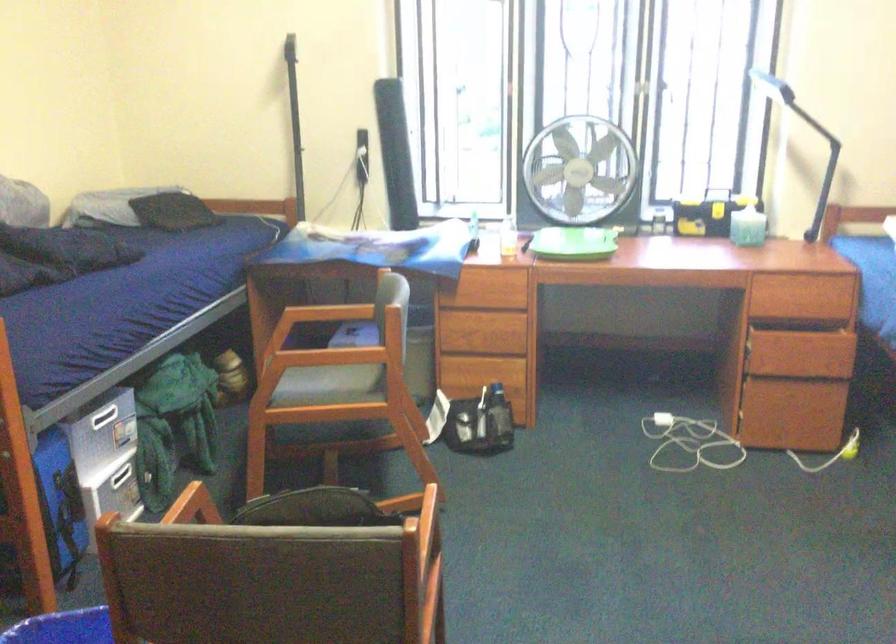
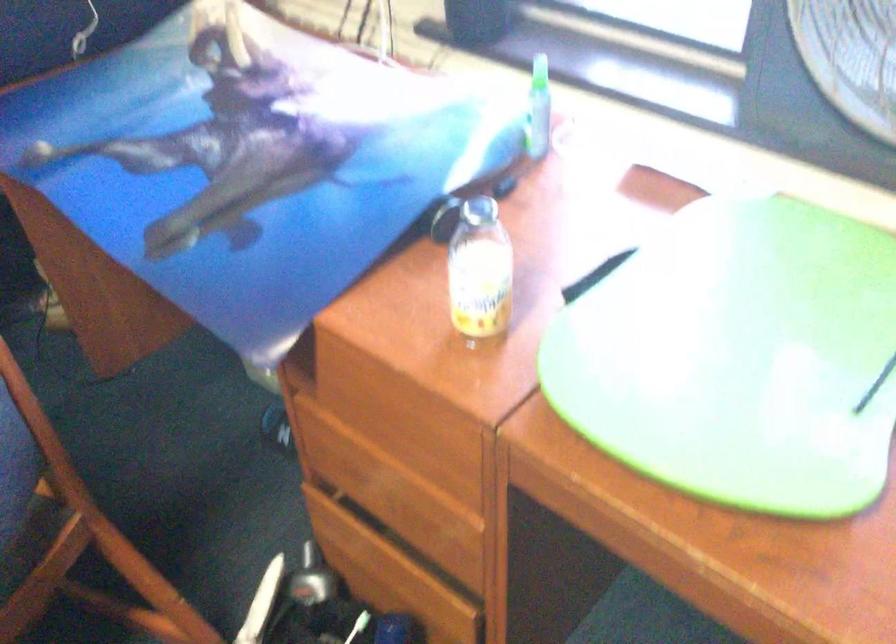
Find the pixel in the second image that matches point 484,299 in the first image.

(383, 435)